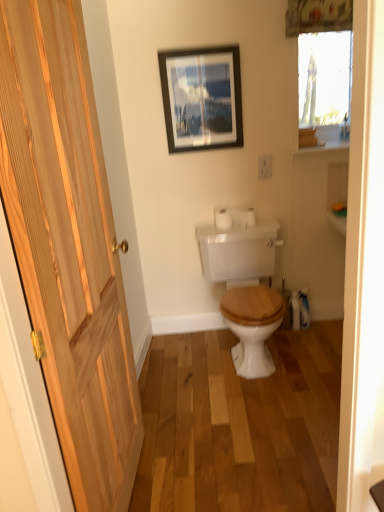
In order to click on vacant area that is in front of white matte toilet paper at center in this screenshot , I will do `click(235, 231)`.